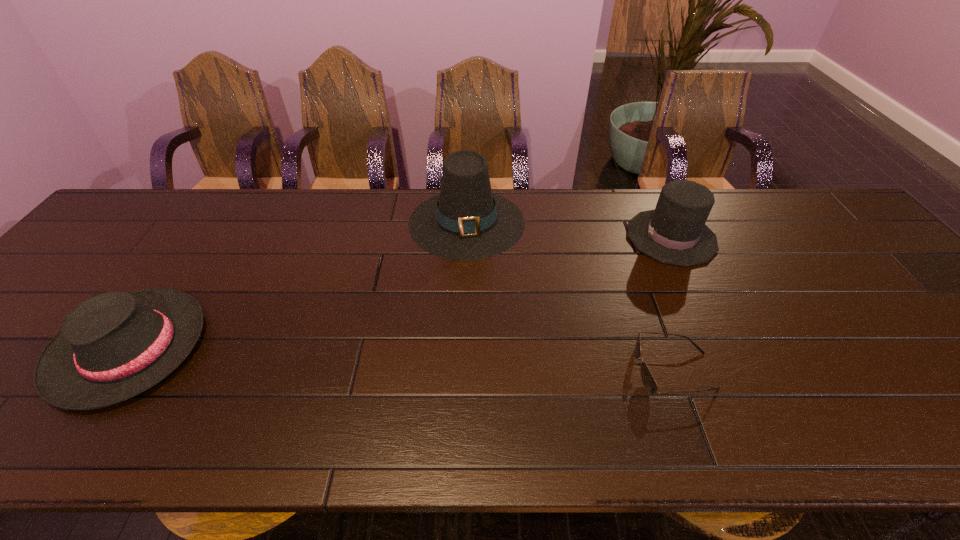
Locate an element on the screen. The image size is (960, 540). free space at the left edge is located at coordinates (83, 285).

Identify the location of vacant region at the right edge of the desktop. The image size is (960, 540). (950, 362).

Where is `free space at the far right corner of the desktop`? Image resolution: width=960 pixels, height=540 pixels. free space at the far right corner of the desktop is located at coordinates (804, 208).

Where is `free space between the rightmost dress hat and the leftmost dress hat`? The width and height of the screenshot is (960, 540). free space between the rightmost dress hat and the leftmost dress hat is located at coordinates (400, 293).

This screenshot has height=540, width=960. I want to click on vacant point located between the leftmost dress hat and the third shortest object, so click(x=400, y=293).

Identify the location of unoccupied position between the third object from right to left and the sunglasses. The image size is (960, 540). (570, 296).

You are a GUI agent. You are given a task and a screenshot of the screen. Output one action in this format:
    pyautogui.click(x=<x>, y=<y>)
    Task: Click on the free space between the second tallest dress hat and the shortest object
    This screenshot has height=540, width=960.
    Given the screenshot: What is the action you would take?
    pyautogui.click(x=672, y=304)

Where is `vacant space that is in between the second dress hat from right to left and the shortest dress hat`? This screenshot has height=540, width=960. vacant space that is in between the second dress hat from right to left and the shortest dress hat is located at coordinates (298, 285).

Image resolution: width=960 pixels, height=540 pixels. I want to click on free space between the shortest object and the rightmost dress hat, so click(x=672, y=304).

I want to click on vacant space that's between the nearest dress hat and the second dress hat from left to right, so click(298, 285).